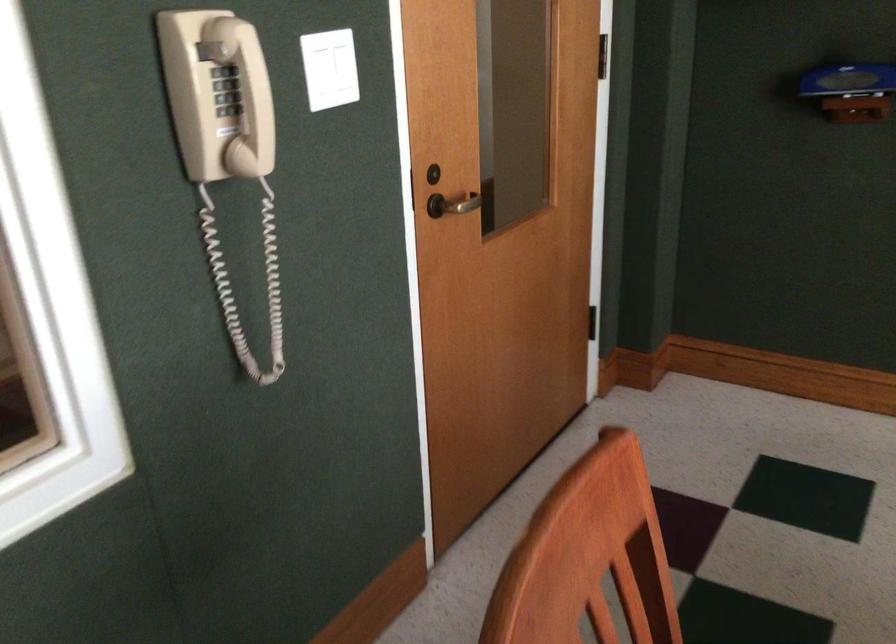
You are a GUI agent. You are given a task and a screenshot of the screen. Output one action in this format:
    pyautogui.click(x=<x>, y=<y>)
    Task: Click on the beige phone handset
    The image size is (896, 644).
    Given the screenshot: What is the action you would take?
    pyautogui.click(x=245, y=95)